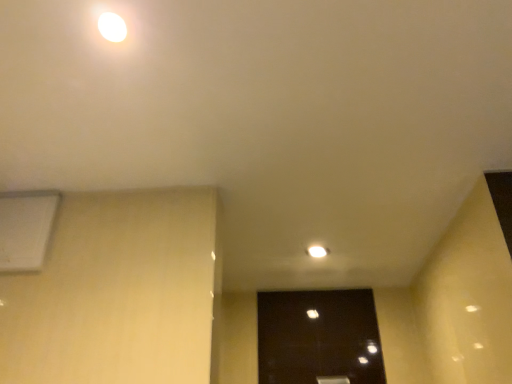
Question: Does point (25, 259) appear closer or farther from the camera than point (104, 18)?

Choices:
 (A) closer
 (B) farther

Answer: (B)

Question: Choose the correct answer: Is white matte air conditioning at upper left inside white glossy light at upper center or outside it?

Choices:
 (A) inside
 (B) outside

Answer: (B)

Question: In terms of width, does white matte air conditioning at upper left look wider or thinner when compared to white glossy light at upper center?

Choices:
 (A) thin
 (B) wide

Answer: (A)

Question: Looking at the image, does white glossy light at upper center seem bigger or smaller compared to white matte air conditioning at upper left?

Choices:
 (A) big
 (B) small

Answer: (B)

Question: From the image's perspective, is white glossy light at upper center positioned above or below white matte air conditioning at upper left?

Choices:
 (A) below
 (B) above

Answer: (B)

Question: Would you say white glossy light at upper center is to the left or to the right of white matte air conditioning at upper left in the picture?

Choices:
 (A) left
 (B) right

Answer: (B)

Question: In the image, is white glossy light at upper center positioned in front of or behind white matte air conditioning at upper left?

Choices:
 (A) behind
 (B) front

Answer: (B)